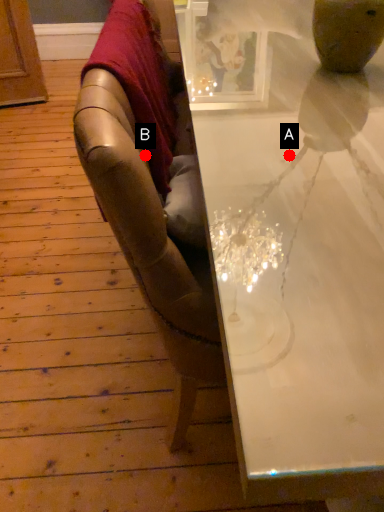
Question: Two points are circled on the image, labeled by A and B beside each circle. Which point is closer to the camera?

Choices:
 (A) A is closer
 (B) B is closer

Answer: (A)